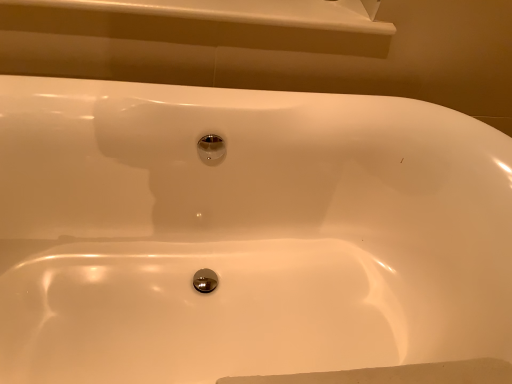
The image size is (512, 384). What do you see at coordinates (239, 12) in the screenshot? I see `white glossy window sill at upper center` at bounding box center [239, 12].

Where is `white glossy window sill at upper center`? This screenshot has height=384, width=512. white glossy window sill at upper center is located at coordinates [239, 12].

Find the location of `white glossy window sill at upper center`. white glossy window sill at upper center is located at coordinates (239, 12).